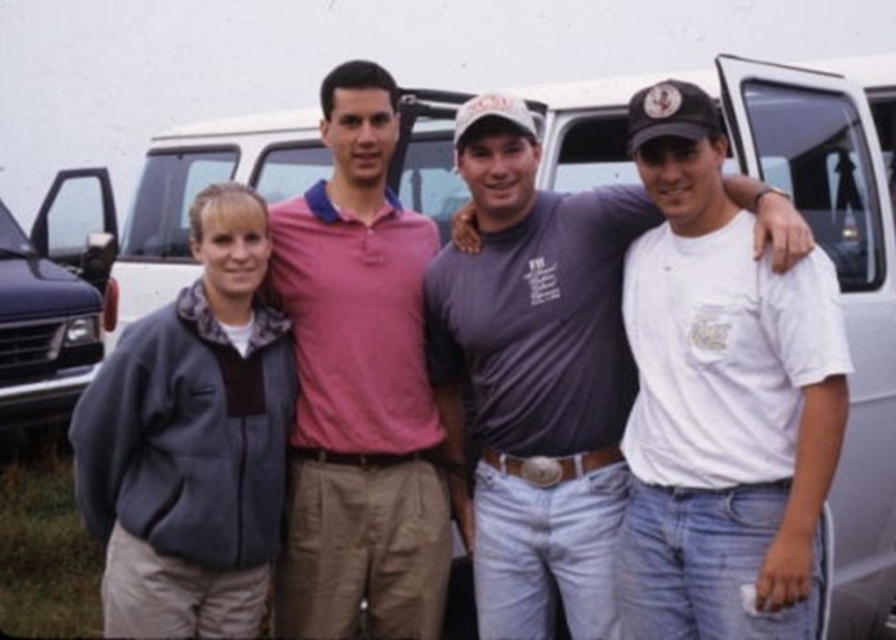
You are standing in front of the white matte minivan at center and want to hand a package to the person wearing the gray fleece jacket at left. Which direction should you move to reach them?

The gray fleece jacket at left is below the white matte minivan at center, so you should move downward to reach the person wearing the gray fleece jacket at left.